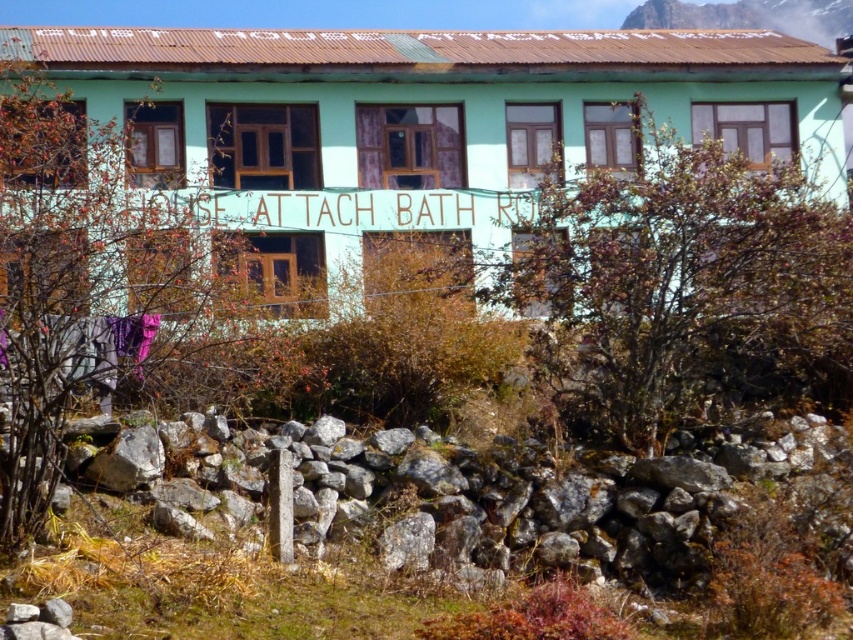
Question: Does gray rock wall at lower center appear under rugged brown rock at upper center?

Choices:
 (A) yes
 (B) no

Answer: (A)

Question: Is gray rock wall at lower center above rugged brown rock at upper center?

Choices:
 (A) yes
 (B) no

Answer: (B)

Question: Which of the following is the farthest from the observer?

Choices:
 (A) (735, 10)
 (B) (606, 506)

Answer: (A)

Question: Which object is closer to the camera taking this photo?

Choices:
 (A) gray rock wall at lower center
 (B) rugged brown rock at upper center

Answer: (A)

Question: Does gray rock wall at lower center have a smaller size compared to rugged brown rock at upper center?

Choices:
 (A) no
 (B) yes

Answer: (B)